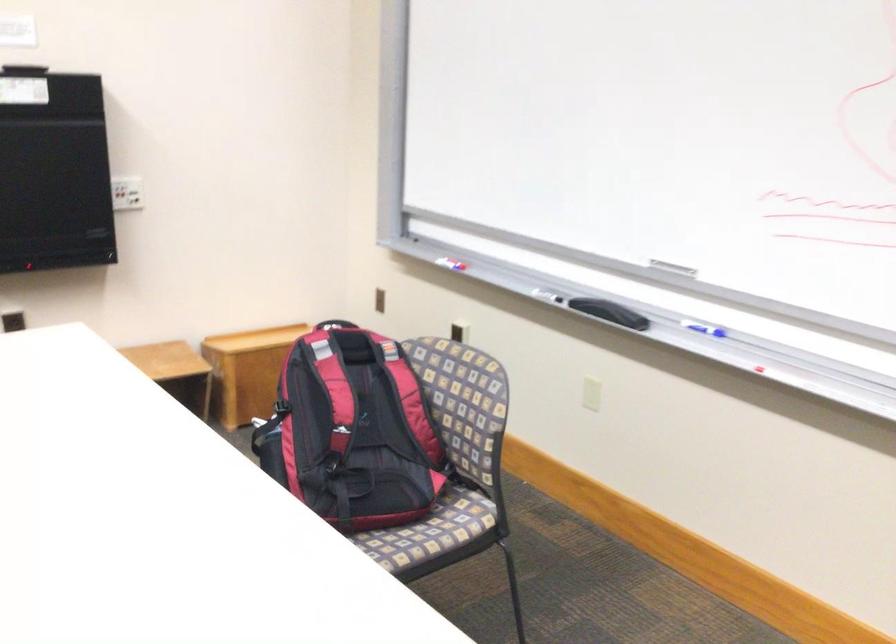
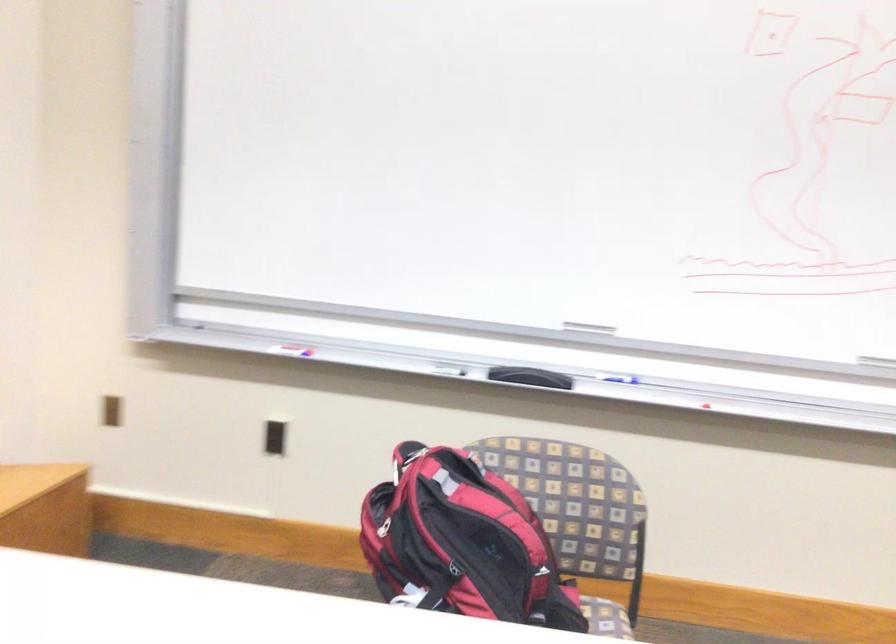
In the second image, find the point that corresponds to pixel 458 252 in the first image.

(288, 345)